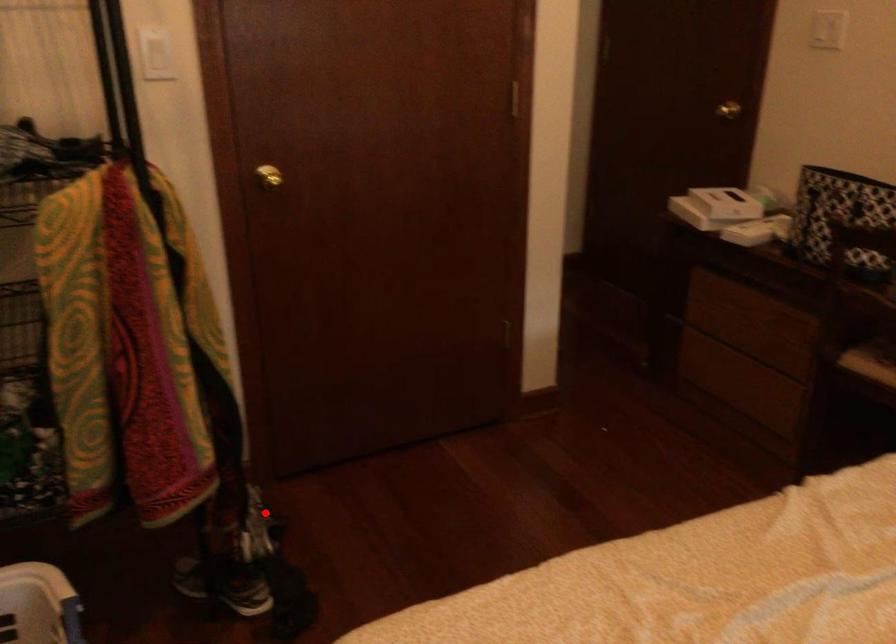
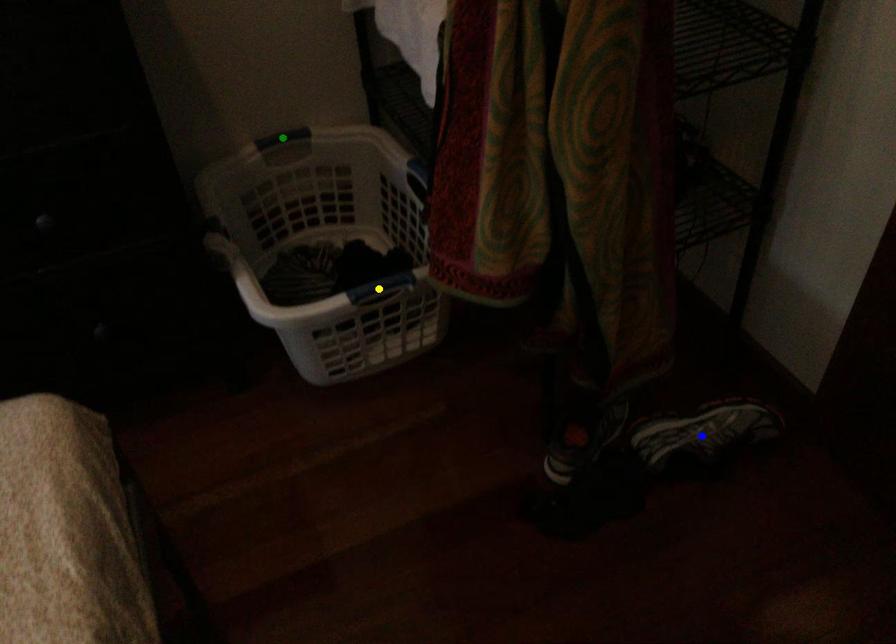
Question: I am providing you with two images of the same scene from different viewpoints. A red point is marked on the first image. You are given multiple points on the second image. Which spot in image 2 lines up with the point in image 1?

Choices:
 (A) green point
 (B) blue point
 (C) yellow point

Answer: (B)